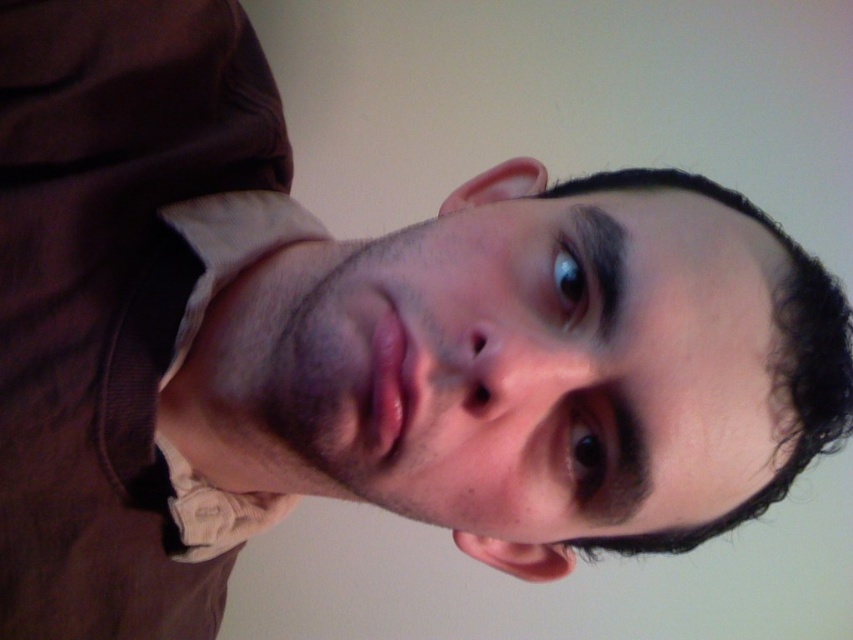
Measure the distance between point [413,353] and camera.

A distance of 16.31 inches exists between point [413,353] and camera.

Who is shorter, smooth skin face at center or white cotton dress shirt at left?

smooth skin face at center

You are a GUI agent. You are given a task and a screenshot of the screen. Output one action in this format:
    pyautogui.click(x=<x>, y=<y>)
    Task: Click on the smooth skin face at center
    
    Given the screenshot: What is the action you would take?
    pyautogui.click(x=546, y=365)